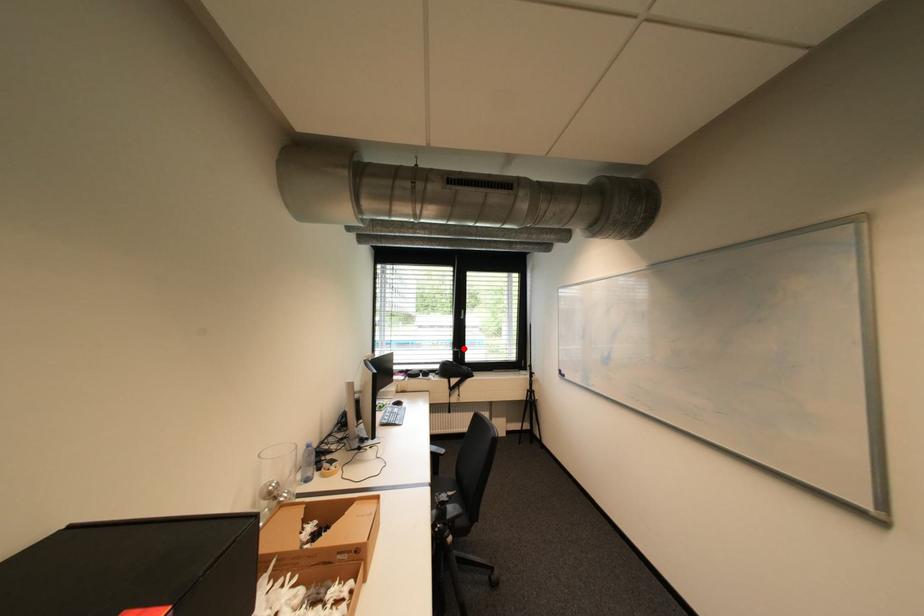
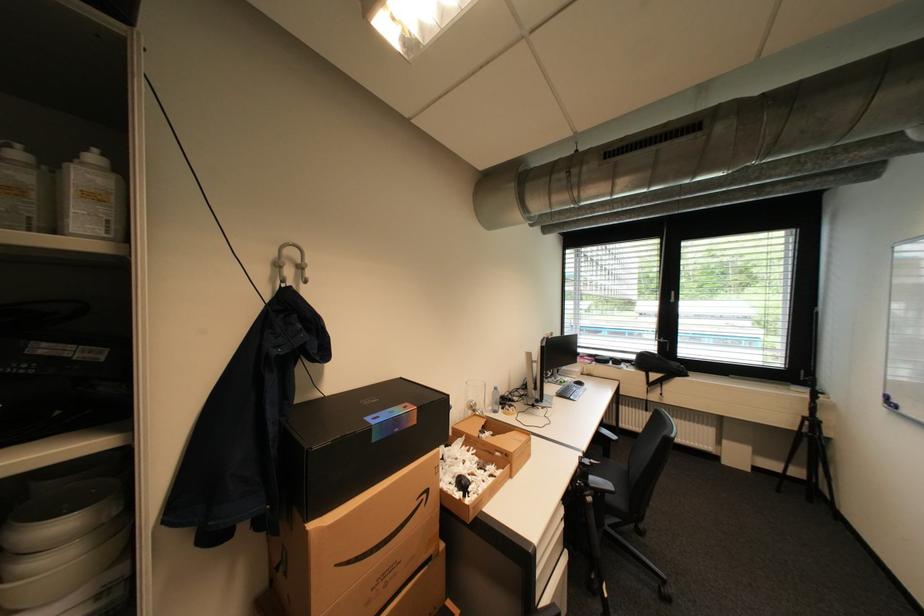
Question: I am providing you with two images of the same scene from different viewpoints. Given a red point in image1, look at the same physical point in image2. Is it:

Choices:
 (A) Closer to the viewpoint
 (B) Farther from the viewpoint

Answer: (A)